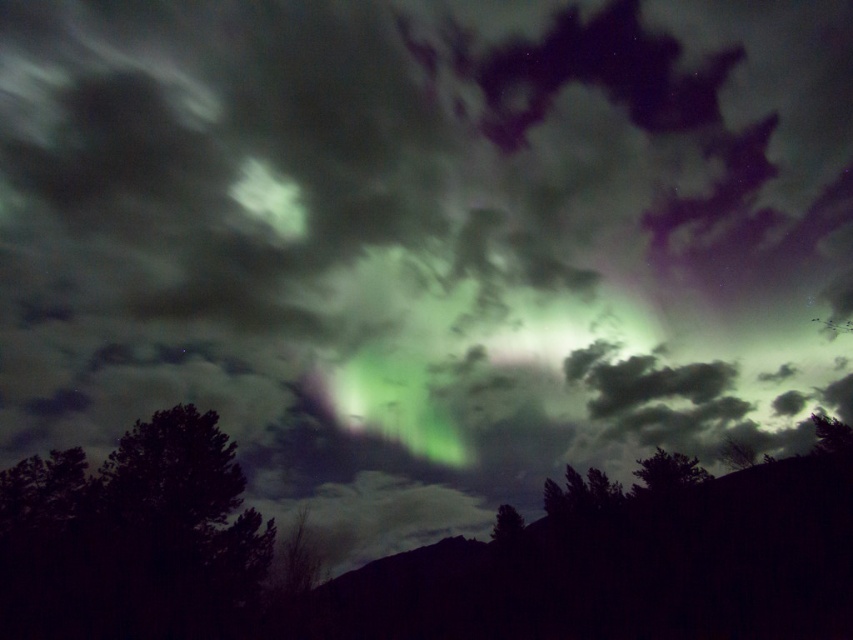
Can you confirm if green leafy tree at lower right is bigger than green leafy tree at lower center?

Yes.

Can you confirm if green leafy tree at lower right is positioned to the right of green leafy tree at lower center?

Indeed, green leafy tree at lower right is positioned on the right side of green leafy tree at lower center.

Is point (647, 468) positioned in front of point (514, 531)?

Yes.

Find the location of a particular element. green leafy tree at lower right is located at coordinates (669, 472).

Does dark green leafy tree at lower left appear under green leafy tree at lower center?

Incorrect, dark green leafy tree at lower left is not positioned below green leafy tree at lower center.

What do you see at coordinates (132, 538) in the screenshot? Image resolution: width=853 pixels, height=640 pixels. I see `dark green leafy tree at lower left` at bounding box center [132, 538].

Does point (131, 573) come in front of point (498, 545)?

Yes, point (131, 573) is closer to viewer.

Where is `dark green leafy tree at lower left`? dark green leafy tree at lower left is located at coordinates (132, 538).

Does dark green leafy tree at lower left have a greater height compared to green leafy tree at lower right?

Yes, dark green leafy tree at lower left is taller than green leafy tree at lower right.

Which is behind, point (257, 512) or point (705, 472)?

The point (705, 472) is behind.

Is point (119, 504) behind point (659, 486)?

That is False.

I want to click on dark green leafy tree at lower left, so click(132, 538).